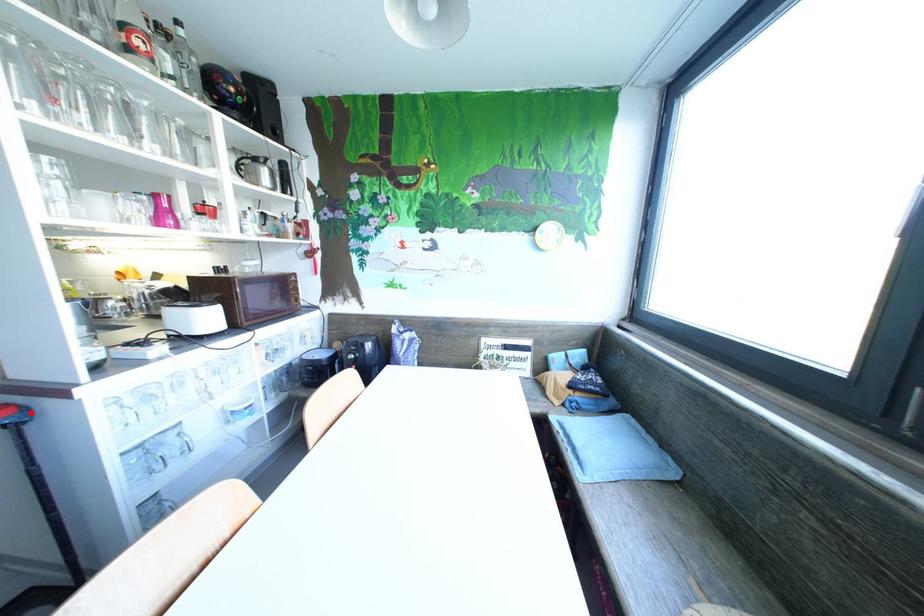
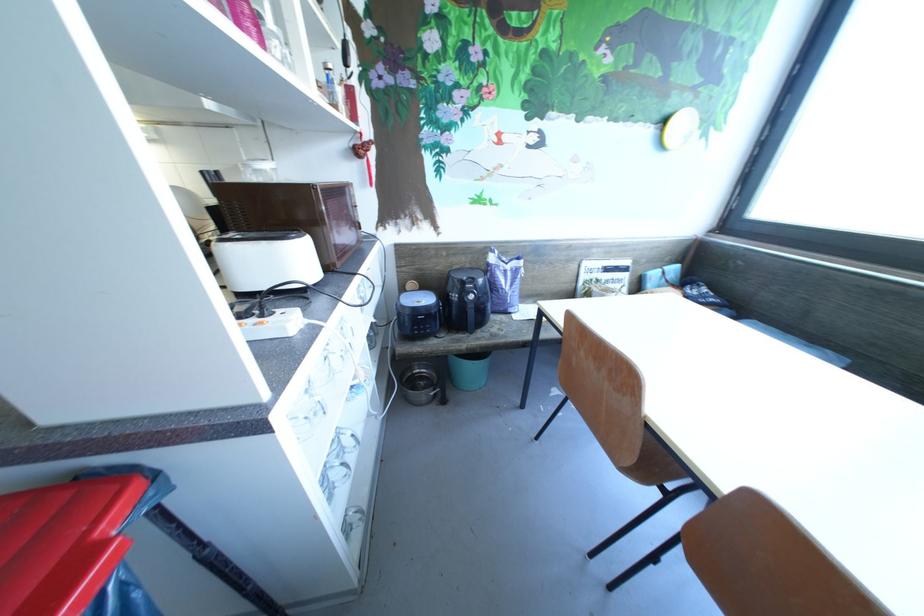
In the second image, find the point that corresponds to the highlighted location in the first image.

(162, 477)